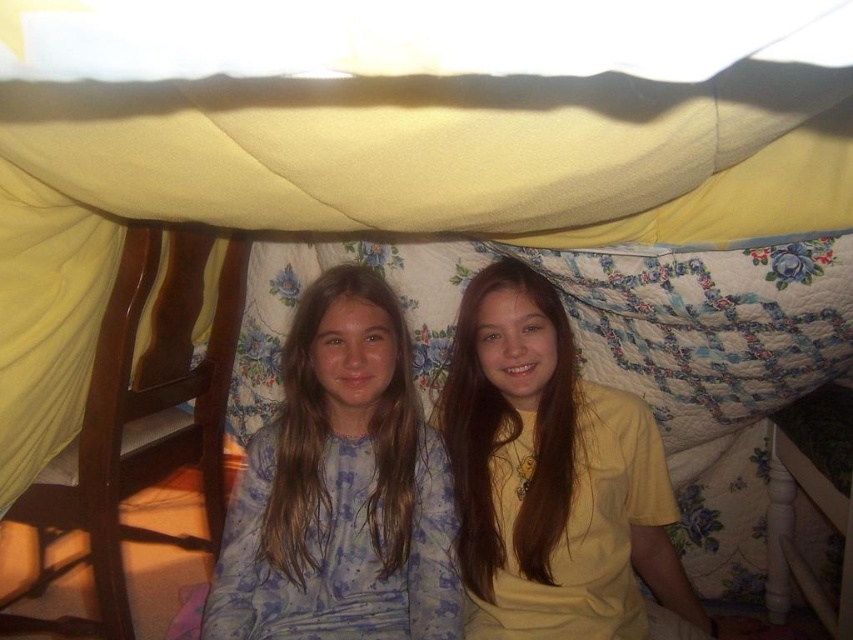
Between point (822, 12) and point (383, 289), which one is positioned behind?

Point (383, 289)

Does yellow fabric canopy at upper center have a greater width compared to light blue pajamas at center?

Indeed, yellow fabric canopy at upper center has a greater width compared to light blue pajamas at center.

I want to click on yellow fabric canopy at upper center, so [436, 113].

Who is taller, light blue pajamas at center or yellow matte shirt at center?

Standing taller between the two is yellow matte shirt at center.

Between point (241, 584) and point (485, 397), which one is positioned behind?

Positioned behind is point (485, 397).

Between point (413, 484) and point (566, 333), which one is positioned in front?

Point (413, 484) is more forward.

Locate an element on the screen. light blue pajamas at center is located at coordinates (340, 488).

Is yellow fabric canopy at upper center above yellow matte shirt at center?

Indeed, yellow fabric canopy at upper center is positioned over yellow matte shirt at center.

Is point (817, 154) behind point (654, 561)?

No, (817, 154) is in front of (654, 561).

Image resolution: width=853 pixels, height=640 pixels. In order to click on yellow fabric canopy at upper center in this screenshot , I will do `click(436, 113)`.

Where is `yellow fabric canopy at upper center`? The height and width of the screenshot is (640, 853). yellow fabric canopy at upper center is located at coordinates click(436, 113).